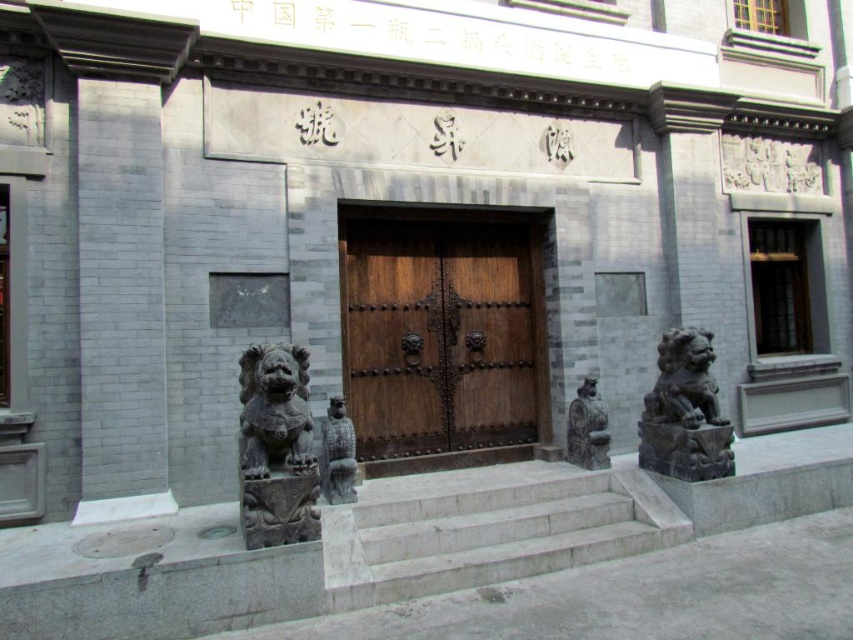
Question: Which point appears closest to the camera in this image?

Choices:
 (A) (590, 464)
 (B) (465, 333)
 (C) (335, 496)

Answer: (C)

Question: Is wooden door at center wider than gray stone statue at center?

Choices:
 (A) yes
 (B) no

Answer: (A)

Question: Is the position of wooden door at center less distant than that of dark gray stone lion at center?

Choices:
 (A) no
 (B) yes

Answer: (A)

Question: Considering the real-world distances, which object is closest to the wooden door at center?

Choices:
 (A) stone statue at center
 (B) dark gray stone lion at right
 (C) dark gray stone lion at center

Answer: (A)

Question: Does dark gray stone lion at center appear over gray stone statue at center?

Choices:
 (A) yes
 (B) no

Answer: (A)

Question: Considering the real-world distances, which object is closest to the wooden door at center?

Choices:
 (A) dark gray stone lion at center
 (B) dark gray stone lion at right

Answer: (B)